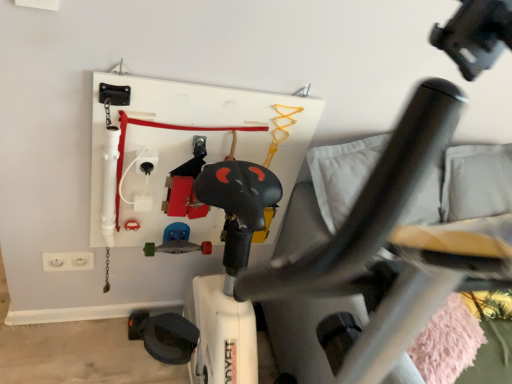
Describe the element at coordinates (68, 261) in the screenshot. I see `white plastic electrical outlet at lower left` at that location.

Identify the location of metallic silver skateboard at center. (177, 242).

From the image's perspective, relative to metallic silver skateboard at center, is black plastic swivel chair at center above or below?

black plastic swivel chair at center is below metallic silver skateboard at center.

Is black plastic swivel chair at center spatially inside metallic silver skateboard at center, or outside of it?

black plastic swivel chair at center is not inside metallic silver skateboard at center, it's outside.

What's the angular difference between black plastic swivel chair at center and metallic silver skateboard at center's facing directions?

The angle between the facing direction of black plastic swivel chair at center and the facing direction of metallic silver skateboard at center is 7.36 degrees.

Where is `swivel chair that is above the white plastic electrical outlet at lower left (from the image's perspective)`? swivel chair that is above the white plastic electrical outlet at lower left (from the image's perspective) is located at coordinates (374, 240).

Considering the sizes of objects white plastic electrical outlet at lower left and black plastic swivel chair at center in the image provided, who is thinner, white plastic electrical outlet at lower left or black plastic swivel chair at center?

Thinner between the two is white plastic electrical outlet at lower left.

What's the angular difference between white plastic electrical outlet at lower left and black plastic swivel chair at center's facing directions?

white plastic electrical outlet at lower left and black plastic swivel chair at center are facing 0.947 degrees away from each other.

Measure the distance between metallic silver skateboard at center and black plastic swivel chair at center.

metallic silver skateboard at center and black plastic swivel chair at center are 1.02 meters apart.

Locate an element on the screen. toy that is above the black plastic swivel chair at center (from the image's perspective) is located at coordinates (177, 242).

Between metallic silver skateboard at center and black plastic swivel chair at center, which one has larger size?

Bigger between the two is black plastic swivel chair at center.

From the image's perspective, who appears lower, metallic silver skateboard at center or black plastic swivel chair at center?

black plastic swivel chair at center is shown below in the image.

Considering the sizes of black plastic swivel chair at center and white plastic electrical outlet at lower left in the image, is black plastic swivel chair at center wider or thinner than white plastic electrical outlet at lower left?

Clearly, black plastic swivel chair at center has more width compared to white plastic electrical outlet at lower left.

Is black plastic swivel chair at center oriented towards white plastic electrical outlet at lower left?

No, black plastic swivel chair at center is not facing towards white plastic electrical outlet at lower left.

Relative to white plastic electrical outlet at lower left, is black plastic swivel chair at center in front or behind?

Visually, black plastic swivel chair at center is located in front of white plastic electrical outlet at lower left.

Is metallic silver skateboard at center facing away from white plastic electrical outlet at lower left?

No, white plastic electrical outlet at lower left is not at the back of metallic silver skateboard at center.

Is white plastic electrical outlet at lower left a part of metallic silver skateboard at center?

No, white plastic electrical outlet at lower left is not surrounded by metallic silver skateboard at center.

Can you confirm if metallic silver skateboard at center is bigger than white plastic electrical outlet at lower left?

Correct, metallic silver skateboard at center is larger in size than white plastic electrical outlet at lower left.

From the image's perspective, which is above, white plastic electrical outlet at lower left or metallic silver skateboard at center?

metallic silver skateboard at center is shown above in the image.

Can you confirm if white plastic electrical outlet at lower left is positioned to the left of metallic silver skateboard at center?

Yes, white plastic electrical outlet at lower left is to the left of metallic silver skateboard at center.

The height and width of the screenshot is (384, 512). I want to click on electric outlet that appears below the metallic silver skateboard at center (from a real-world perspective), so click(68, 261).

Consider the image. What's the angular difference between white plastic electrical outlet at lower left and metallic silver skateboard at center's facing directions?

The facing directions of white plastic electrical outlet at lower left and metallic silver skateboard at center are 6.41 degrees apart.

I want to click on swivel chair above the metallic silver skateboard at center (from a real-world perspective), so click(x=374, y=240).

Locate an element on the screen. This screenshot has width=512, height=384. swivel chair on the right of white plastic electrical outlet at lower left is located at coordinates click(x=374, y=240).

Estimate the real-world distances between objects in this image. Which object is further from black plastic swivel chair at center, white plastic electrical outlet at lower left or metallic silver skateboard at center?

Based on the image, white plastic electrical outlet at lower left appears to be further to black plastic swivel chair at center.

Based on their spatial positions, is metallic silver skateboard at center or black plastic swivel chair at center further from white plastic electrical outlet at lower left?

Based on the image, black plastic swivel chair at center appears to be further to white plastic electrical outlet at lower left.

When comparing their distances from black plastic swivel chair at center, does metallic silver skateboard at center or white plastic electrical outlet at lower left seem further?

The object further to black plastic swivel chair at center is white plastic electrical outlet at lower left.

Which object lies nearer to the anchor point metallic silver skateboard at center, black plastic swivel chair at center or white plastic electrical outlet at lower left?

The object closer to metallic silver skateboard at center is white plastic electrical outlet at lower left.

Considering their positions, is white plastic electrical outlet at lower left positioned closer to metallic silver skateboard at center than black plastic swivel chair at center?

white plastic electrical outlet at lower left.

Which object lies further to the anchor point white plastic electrical outlet at lower left, black plastic swivel chair at center or metallic silver skateboard at center?

black plastic swivel chair at center is further to white plastic electrical outlet at lower left.

Where is `toy between black plastic swivel chair at center and white plastic electrical outlet at lower left from front to back`? toy between black plastic swivel chair at center and white plastic electrical outlet at lower left from front to back is located at coordinates (177, 242).